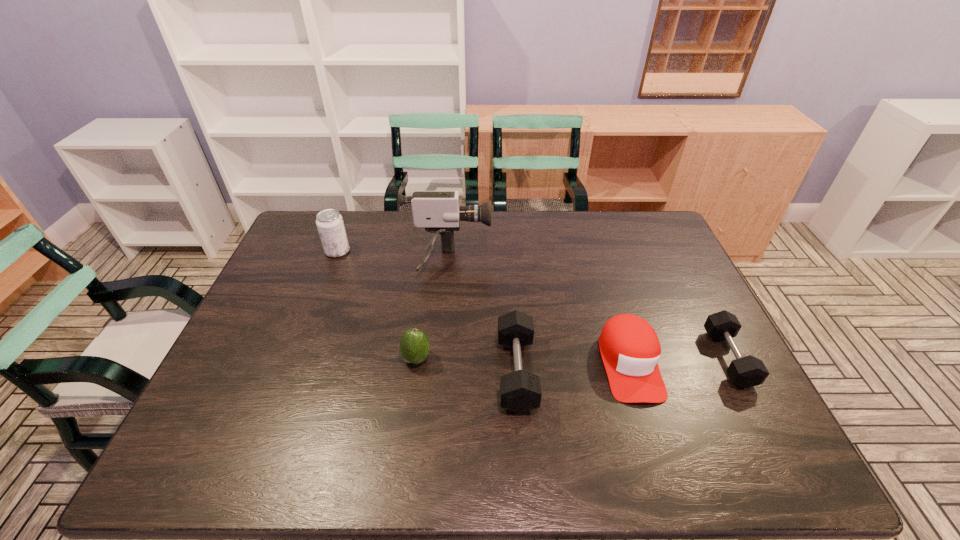
The width and height of the screenshot is (960, 540). In order to click on empty location between the avocado and the fifth object from left to right in this screenshot , I will do pyautogui.click(x=523, y=361).

This screenshot has height=540, width=960. Find the location of `vacant space that is in between the avocado and the shortest object`. vacant space that is in between the avocado and the shortest object is located at coordinates (572, 359).

Locate an element on the screen. The image size is (960, 540). free area in between the soda can and the left dumbbell is located at coordinates (427, 312).

The height and width of the screenshot is (540, 960). What are the coordinates of `free space between the avocado and the camcorder` in the screenshot? It's located at (432, 310).

The image size is (960, 540). Find the location of `free spot between the third object from right to left and the second object from right to left`. free spot between the third object from right to left and the second object from right to left is located at coordinates (573, 368).

Find the location of a particular element. Image resolution: width=960 pixels, height=540 pixels. free space between the avocado and the camcorder is located at coordinates (432, 310).

Where is `vacant area that lies between the baseball cap and the tallest object`? vacant area that lies between the baseball cap and the tallest object is located at coordinates (539, 313).

Where is `free space that is in between the tallest object and the left dumbbell`? Image resolution: width=960 pixels, height=540 pixels. free space that is in between the tallest object and the left dumbbell is located at coordinates (482, 318).

Find the location of a particular element. free spot between the tallest object and the baseball cap is located at coordinates (539, 313).

Identify which object is the fourth nearest to the soda can. Please provide its 2D coordinates. Your answer should be formatted as a tuple, i.e. [(x, y)], where the tuple contains the x and y coordinates of a point satisfying the conditions above.

[(630, 349)]